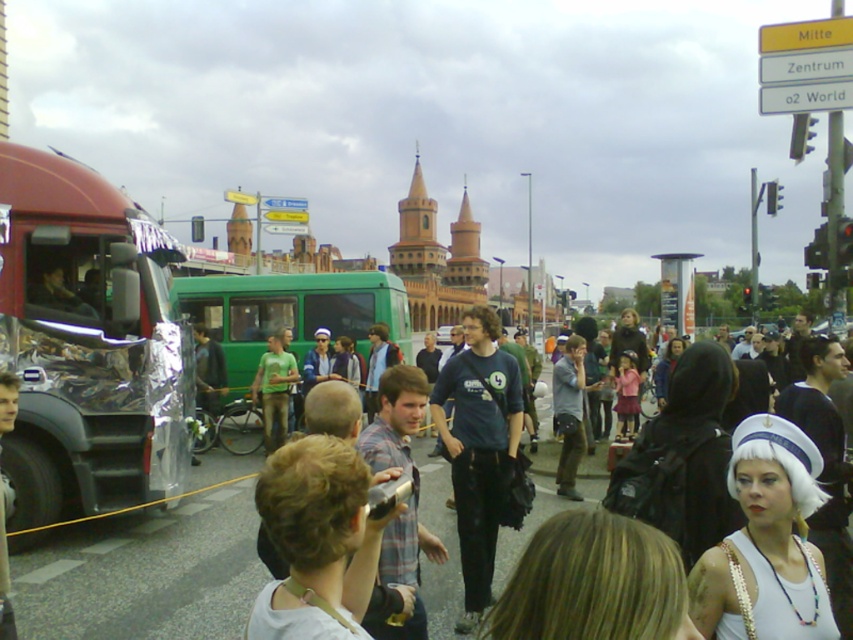
Does green matte van at center have a lesser width compared to matte black backpack at center?

Yes.

Is green matte van at center further to camera compared to matte black backpack at center?

Yes, green matte van at center is behind matte black backpack at center.

Is point (273, 312) behind point (751, 392)?

Yes, it is behind point (751, 392).

Image resolution: width=853 pixels, height=640 pixels. What are the coordinates of `green matte van at center` in the screenshot? It's located at (289, 314).

The height and width of the screenshot is (640, 853). Find the location of `white matte wig at center`. white matte wig at center is located at coordinates (766, 544).

Can you confirm if white matte wig at center is smaller than light brown hair at center?

No, white matte wig at center is not smaller than light brown hair at center.

Between point (741, 580) and point (323, 486), which one is positioned behind?

Point (741, 580)

I want to click on white matte wig at center, so click(x=766, y=544).

Can you confirm if shiny metallic truck at left is taller than light brown hair at center?

Correct, shiny metallic truck at left is much taller as light brown hair at center.

Is point (27, 353) farther from camera compared to point (352, 454)?

Yes, point (27, 353) is farther from viewer.

Image resolution: width=853 pixels, height=640 pixels. Identify the location of shiny metallic truck at left. click(x=88, y=340).